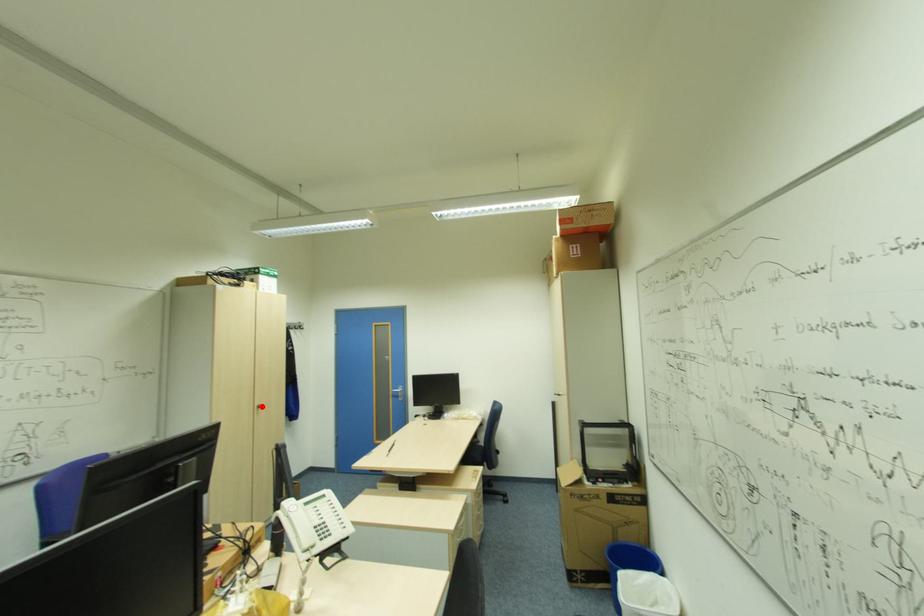
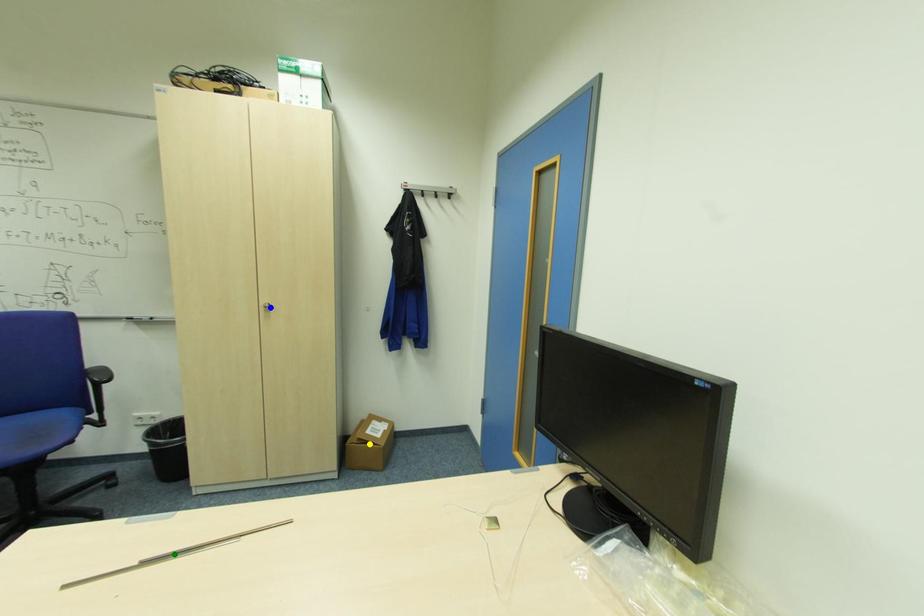
Question: I am providing you with two images of the same scene from different viewpoints. A red point is marked on the first image. You are given multiple points on the second image. Can you choose the point in image 2 that corresponds to the point in image 1?

Choices:
 (A) yellow point
 (B) green point
 (C) blue point

Answer: (C)